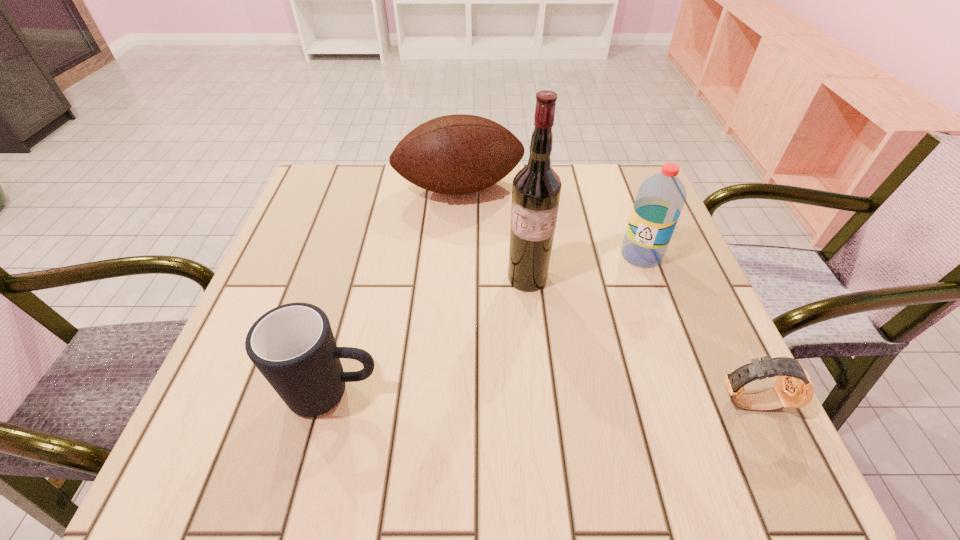
Find the location of a particular element. This screenshot has height=540, width=960. empty location between the football and the fourth tallest object is located at coordinates (396, 291).

Locate an element on the screen. This screenshot has width=960, height=540. empty location between the football and the tallest object is located at coordinates (493, 233).

The width and height of the screenshot is (960, 540). Find the location of `vacant space in between the farthest object and the tallest object`. vacant space in between the farthest object and the tallest object is located at coordinates (493, 233).

Locate an element on the screen. free spot between the mug and the watch is located at coordinates (540, 397).

Where is `free space between the watch and the tallest object`? The height and width of the screenshot is (540, 960). free space between the watch and the tallest object is located at coordinates (637, 340).

The image size is (960, 540). I want to click on free space that is in between the mug and the water bottle, so click(x=487, y=324).

This screenshot has height=540, width=960. I want to click on empty space between the wine bottle and the watch, so click(637, 340).

At what (x,y) coordinates should I click in order to perform the action: click on blank region between the farthest object and the fourth tallest object. Please return your answer as a coordinate pair (x, y). This screenshot has width=960, height=540. Looking at the image, I should click on (396, 291).

At what (x,y) coordinates should I click in order to perform the action: click on the fourth closest object relative to the water bottle. Please return your answer as a coordinate pair (x, y). Looking at the image, I should click on click(x=292, y=345).

Find the location of a particular element. object that can be found as the closest to the watch is located at coordinates (660, 199).